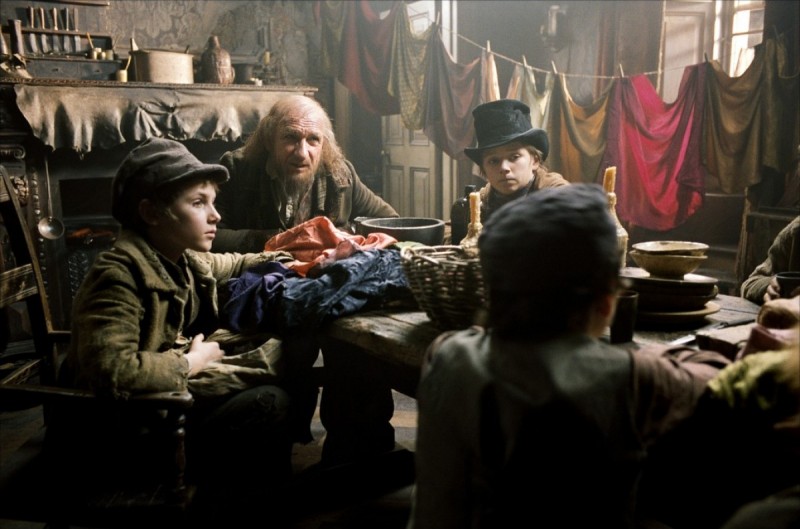
Find the location of `basket`. basket is located at coordinates (440, 282).